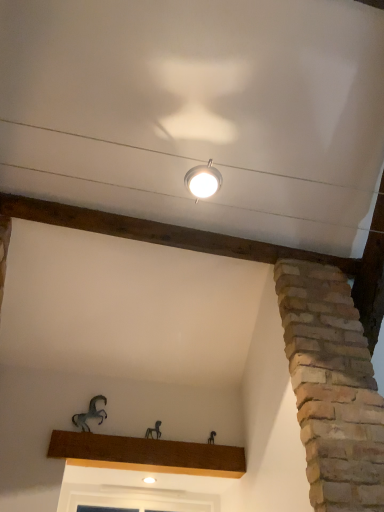
Question: Can you confirm if matte silver lamp at upper center is shorter than brown wood at center?

Choices:
 (A) yes
 (B) no

Answer: (A)

Question: Is matte silver lamp at upper center bigger than brown wood at center?

Choices:
 (A) yes
 (B) no

Answer: (B)

Question: Is brown wood at center a part of matte silver lamp at upper center?

Choices:
 (A) no
 (B) yes

Answer: (A)

Question: Considering the relative sizes of matte silver lamp at upper center and brown wood at center in the image provided, is matte silver lamp at upper center wider than brown wood at center?

Choices:
 (A) yes
 (B) no

Answer: (A)

Question: Would you consider matte silver lamp at upper center to be distant from brown wood at center?

Choices:
 (A) no
 (B) yes

Answer: (B)

Question: Is matte silver lamp at upper center taller than brown wood at center?

Choices:
 (A) no
 (B) yes

Answer: (A)

Question: Does metallic horse at lower left, placed as the second animal when sorted from bottom to top, appear on the left side of matte silver lamp at upper center?

Choices:
 (A) no
 (B) yes

Answer: (B)

Question: Is matte silver lamp at upper center surrounded by metallic horse at lower left, which is the first animal from left to right?

Choices:
 (A) no
 (B) yes

Answer: (A)

Question: From the image's perspective, would you say metallic horse at lower left, which is the first animal from left to right, is shown under matte silver lamp at upper center?

Choices:
 (A) no
 (B) yes

Answer: (B)

Question: Is metallic horse at lower left, which is the first animal from left to right, located outside matte silver lamp at upper center?

Choices:
 (A) yes
 (B) no

Answer: (A)

Question: Is metallic horse at lower left, placed as the second animal when sorted from bottom to top, looking in the opposite direction of matte silver lamp at upper center?

Choices:
 (A) no
 (B) yes

Answer: (A)

Question: Does metallic horse at lower left, acting as the first animal starting from the top, lie in front of matte silver lamp at upper center?

Choices:
 (A) yes
 (B) no

Answer: (B)

Question: Does metallic horse at center, the 1th animal in the right-to-left sequence, have a lesser width compared to metallic horse at lower left, which is the first animal from left to right?

Choices:
 (A) yes
 (B) no

Answer: (A)